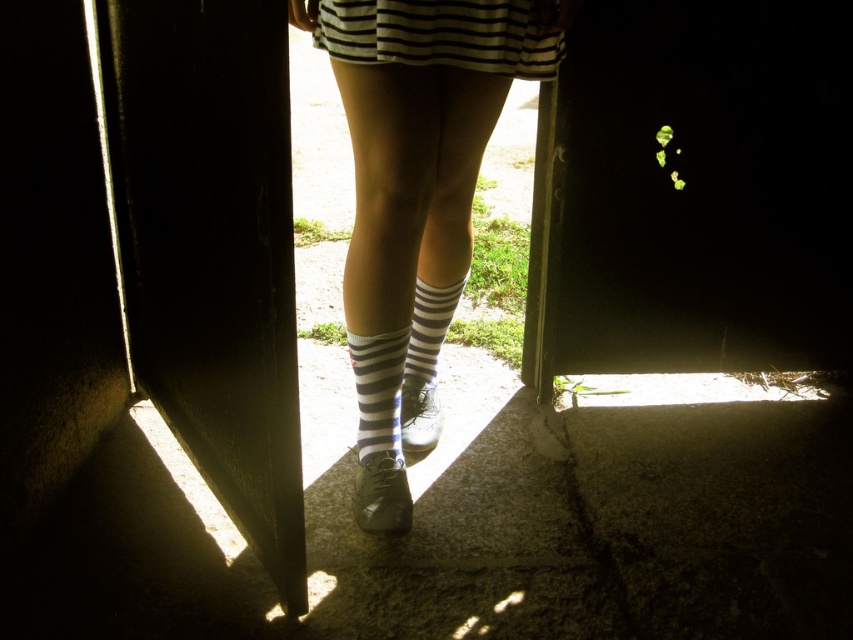
You are a delivery person trying to exit through the black matte door at center while wearing your striped cotton socks at center. Can you comfortably walk through the door without touching the sides?

The black matte door at center is wider than the striped cotton socks at center, so yes, you can comfortably walk through the door without touching the sides.

You are trying to determine which item is closer to the ground between the striped cotton sock at center and the striped cotton socks at center. Which one is closer?

The striped cotton sock at center is shorter than striped cotton socks at center, so the striped cotton sock at center is closer to the ground.